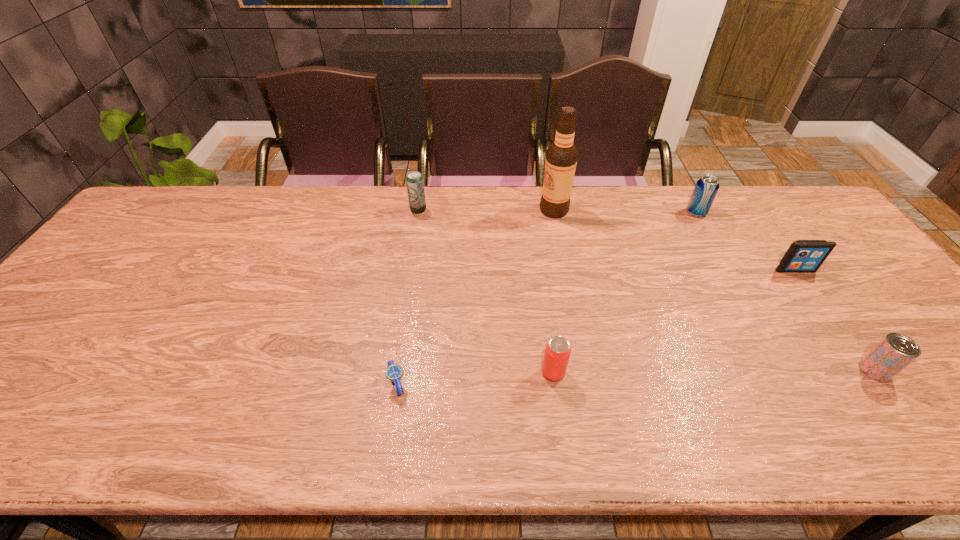
Identify the location of alcohol. The image size is (960, 540). (561, 156).

At what (x,y) coordinates should I click in order to perform the action: click on the leftmost beer can. Please return your answer as a coordinate pair (x, y). Looking at the image, I should click on (415, 185).

The image size is (960, 540). What are the coordinates of `the second beer can from right to left` in the screenshot? It's located at (706, 188).

At what (x,y) coordinates should I click in order to perform the action: click on the second beer can from left to right. Please return your answer as a coordinate pair (x, y). Looking at the image, I should click on (557, 352).

The width and height of the screenshot is (960, 540). Identify the location of iPod. (803, 256).

Locate an element on the screen. This screenshot has width=960, height=540. the rightmost beer can is located at coordinates (895, 351).

The height and width of the screenshot is (540, 960). I want to click on the shortest object, so click(394, 372).

The width and height of the screenshot is (960, 540). I want to click on vacant space situated on the label of the alcohol, so click(x=462, y=210).

What are the coordinates of `vacant space positioned 0.180m on the label of the alcohol` in the screenshot? It's located at (484, 210).

Locate an element on the screen. The height and width of the screenshot is (540, 960). free location located on the label of the alcohol is located at coordinates 456,210.